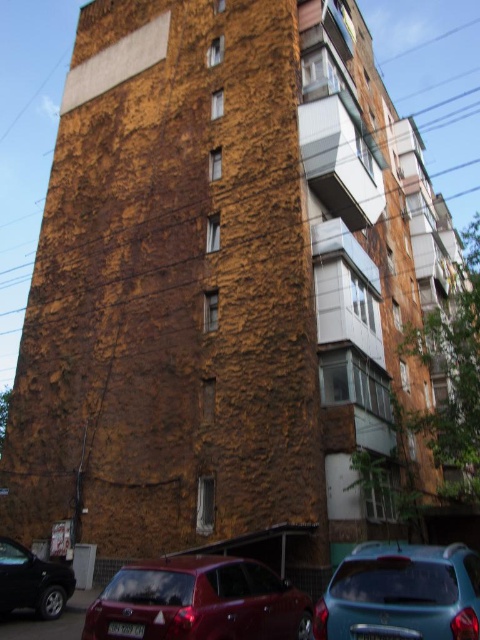
You are standing in front of the residential building and notice two points marked on the facade. The first point is at coordinate point (134, 616) and the second at point (8, 579). Based on their positions, which point is closer to you?

Point (134, 616) is in front of point (8, 579), so it is closer to you.